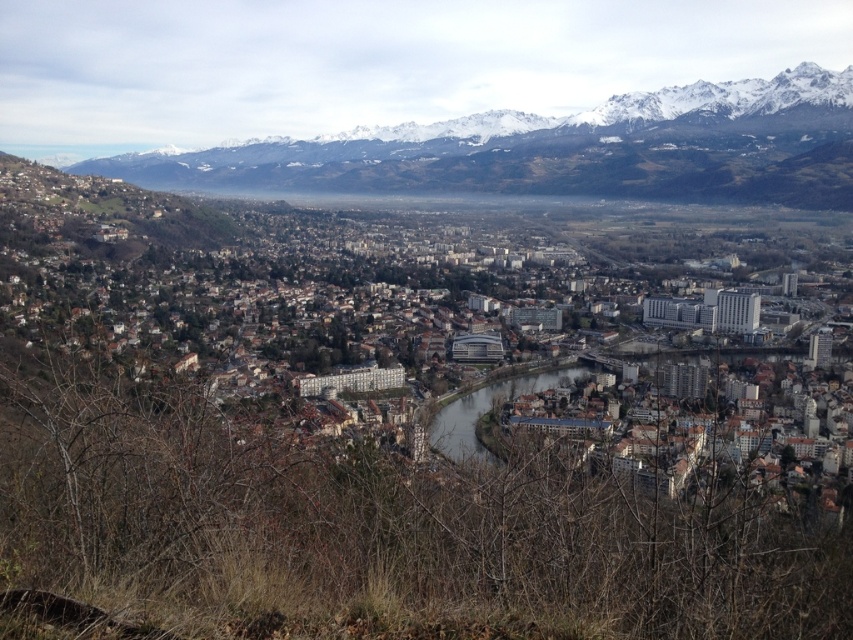
Question: Which point appears farthest from the camera in this image?

Choices:
 (A) (177, 186)
 (B) (469, 404)

Answer: (A)

Question: Does snowy mountain range at upper center appear under brown concrete river at center?

Choices:
 (A) no
 (B) yes

Answer: (A)

Question: Where is snowy mountain range at upper center located in relation to brown concrete river at center in the image?

Choices:
 (A) right
 (B) left

Answer: (B)

Question: Is snowy mountain range at upper center wider than brown concrete river at center?

Choices:
 (A) no
 (B) yes

Answer: (B)